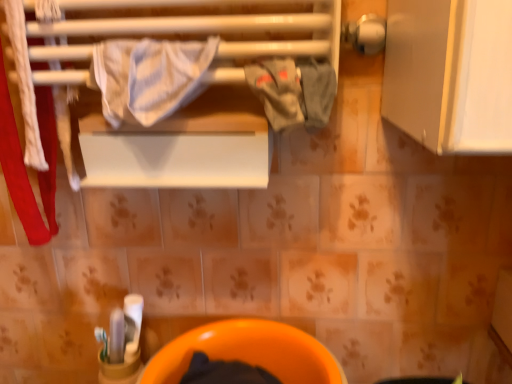
This screenshot has height=384, width=512. What do you see at coordinates (249, 352) in the screenshot? I see `orange glossy toilet bowl at lower center` at bounding box center [249, 352].

Locate an element on the screen. white striped fabric at upper center is located at coordinates (149, 77).

I want to click on orange glossy toilet bowl at lower center, so click(249, 352).

How distant is white striped fabric at upper center from gray cotton cloth at center?

A distance of 5.24 inches exists between white striped fabric at upper center and gray cotton cloth at center.

From the picture: Is white striped fabric at upper center positioned with its back to gray cotton cloth at center?

white striped fabric at upper center is not turned away from gray cotton cloth at center.

Is white striped fabric at upper center touching gray cotton cloth at center?

white striped fabric at upper center and gray cotton cloth at center are clearly separated.

From the image's perspective, is white striped fabric at upper center above or below gray cotton cloth at center?

Clearly, from the image's perspective, white striped fabric at upper center is above gray cotton cloth at center.

From the image's perspective, is gray cotton cloth at center over white striped fabric at upper center?

Incorrect, from the image's perspective, gray cotton cloth at center is lower than white striped fabric at upper center.

Are gray cotton cloth at center and white striped fabric at upper center located far from each other?

They are positioned close to each other.

In terms of width, does gray cotton cloth at center look wider or thinner when compared to white striped fabric at upper center?

Considering their sizes, gray cotton cloth at center looks slimmer than white striped fabric at upper center.

From the image's perspective, who appears lower, white striped fabric at upper center or orange glossy toilet bowl at lower center?

orange glossy toilet bowl at lower center.

Is white striped fabric at upper center situated inside orange glossy toilet bowl at lower center or outside?

white striped fabric at upper center exists outside the volume of orange glossy toilet bowl at lower center.

Is point (156, 83) less distant than point (325, 353)?

Yes, point (156, 83) is in front of point (325, 353).

What's the angular difference between white striped fabric at upper center and orange glossy toilet bowl at lower center's facing directions?

The facing directions of white striped fabric at upper center and orange glossy toilet bowl at lower center are 3.25 degrees apart.

From a real-world perspective, who is located lower, gray cotton cloth at center or orange glossy toilet bowl at lower center?

orange glossy toilet bowl at lower center, from a real-world perspective.

Is gray cotton cloth at center directly adjacent to orange glossy toilet bowl at lower center?

gray cotton cloth at center and orange glossy toilet bowl at lower center are clearly separated.

Which is closer, [316,99] or [181,337]?

The point [316,99] is in front.

Is gray cotton cloth at center spatially inside orange glossy toilet bowl at lower center, or outside of it?

gray cotton cloth at center is located beyond the bounds of orange glossy toilet bowl at lower center.

This screenshot has width=512, height=384. What are the coordinates of `clothing on the right of orange glossy toilet bowl at lower center` in the screenshot? It's located at (293, 92).

Who is more distant, orange glossy toilet bowl at lower center or gray cotton cloth at center?

orange glossy toilet bowl at lower center is further away from the camera.

How many degrees apart are the facing directions of orange glossy toilet bowl at lower center and gray cotton cloth at center?

3.25 degrees.

Could you tell me if orange glossy toilet bowl at lower center is facing white striped fabric at upper center?

No, orange glossy toilet bowl at lower center is not facing towards white striped fabric at upper center.

Considering the sizes of objects orange glossy toilet bowl at lower center and white striped fabric at upper center in the image provided, who is taller, orange glossy toilet bowl at lower center or white striped fabric at upper center?

With more height is orange glossy toilet bowl at lower center.

How distant is orange glossy toilet bowl at lower center from white striped fabric at upper center?

orange glossy toilet bowl at lower center and white striped fabric at upper center are 46.80 centimeters apart.

Considering the sizes of objects orange glossy toilet bowl at lower center and white striped fabric at upper center in the image provided, who is smaller, orange glossy toilet bowl at lower center or white striped fabric at upper center?

white striped fabric at upper center.

Image resolution: width=512 pixels, height=384 pixels. I want to click on bath towel above the gray cotton cloth at center (from a real-world perspective), so click(x=149, y=77).

You are a GUI agent. You are given a task and a screenshot of the screen. Output one action in this format:
    pyautogui.click(x=<x>, y=<y>)
    Task: Click on the bath towel lying on the left of gray cotton cloth at center
    The image size is (512, 384).
    Given the screenshot: What is the action you would take?
    pyautogui.click(x=149, y=77)

Considering their positions, is gray cotton cloth at center positioned further to orange glossy toilet bowl at lower center than white striped fabric at upper center?

Based on the image, white striped fabric at upper center appears to be further to orange glossy toilet bowl at lower center.

Estimate the real-world distances between objects in this image. Which object is further from gray cotton cloth at center, white striped fabric at upper center or orange glossy toilet bowl at lower center?

orange glossy toilet bowl at lower center.

Based on their spatial positions, is gray cotton cloth at center or orange glossy toilet bowl at lower center closer to white striped fabric at upper center?

gray cotton cloth at center.

From the image, which object appears to be farther from white striped fabric at upper center, orange glossy toilet bowl at lower center or gray cotton cloth at center?

orange glossy toilet bowl at lower center.

Estimate the real-world distances between objects in this image. Which object is closer to orange glossy toilet bowl at lower center, white striped fabric at upper center or gray cotton cloth at center?

gray cotton cloth at center.

From the image, which object appears to be nearer to gray cotton cloth at center, orange glossy toilet bowl at lower center or white striped fabric at upper center?

white striped fabric at upper center.

The width and height of the screenshot is (512, 384). I want to click on clothing that lies between white striped fabric at upper center and orange glossy toilet bowl at lower center from top to bottom, so click(x=293, y=92).